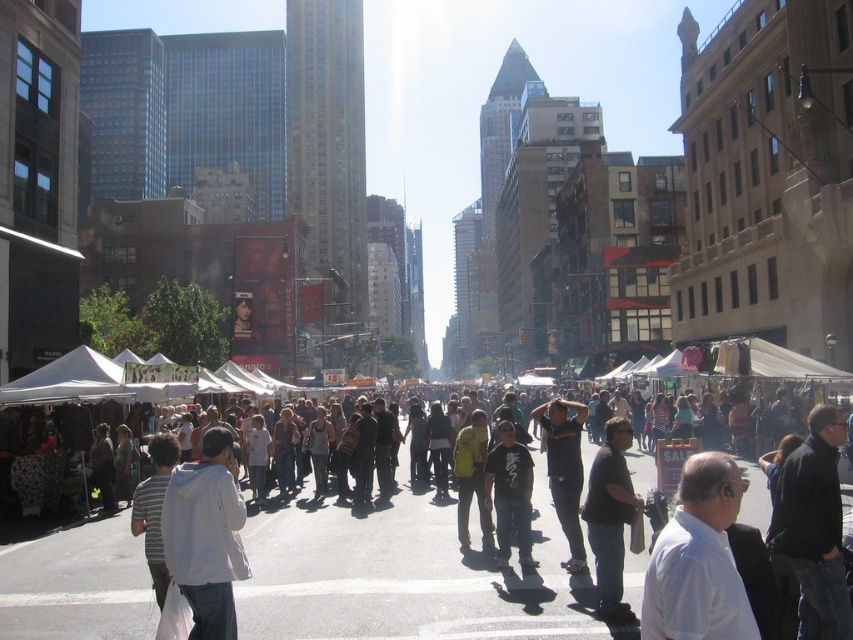
Question: Which point is closer to the camera?

Choices:
 (A) black cotton shirt at center-right
 (B) black matte shirt at center
 (C) white fabric tents at center

Answer: (C)

Question: Does white shirt at lower right appear under black matte shirt at center?

Choices:
 (A) no
 (B) yes

Answer: (A)

Question: Which point appears farthest from the camera in this image?

Choices:
 (A) (532, 557)
 (B) (688, 625)
 (C) (593, 516)

Answer: (A)

Question: Which point appears closest to the camera in this image?

Choices:
 (A) (7, 564)
 (B) (241, 508)
 (C) (567, 515)

Answer: (B)

Question: Is dark gray pants at center bigger than black matte shirt at center?

Choices:
 (A) no
 (B) yes

Answer: (B)

Question: Is white shirt at lower right closer to the viewer compared to black cotton shirt at center-right?

Choices:
 (A) yes
 (B) no

Answer: (A)